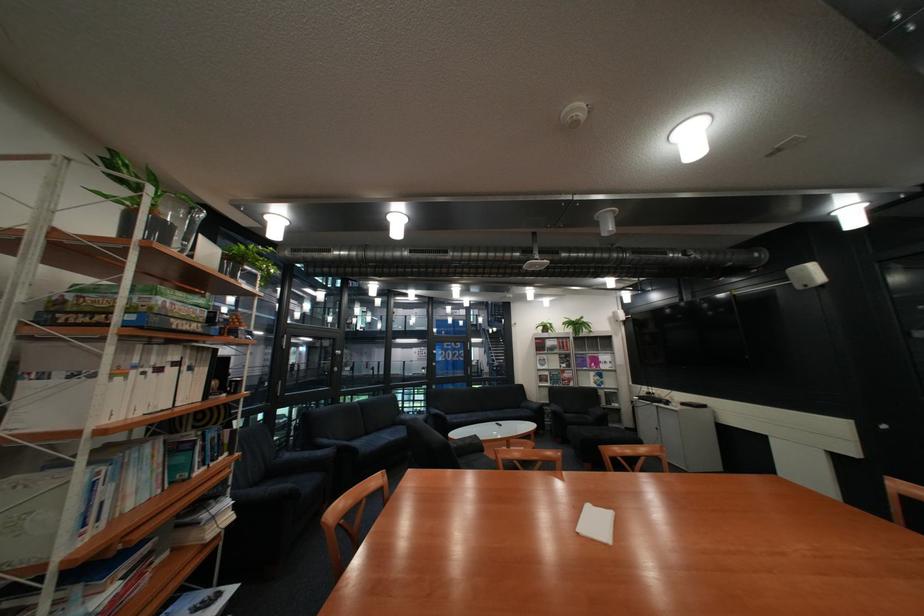
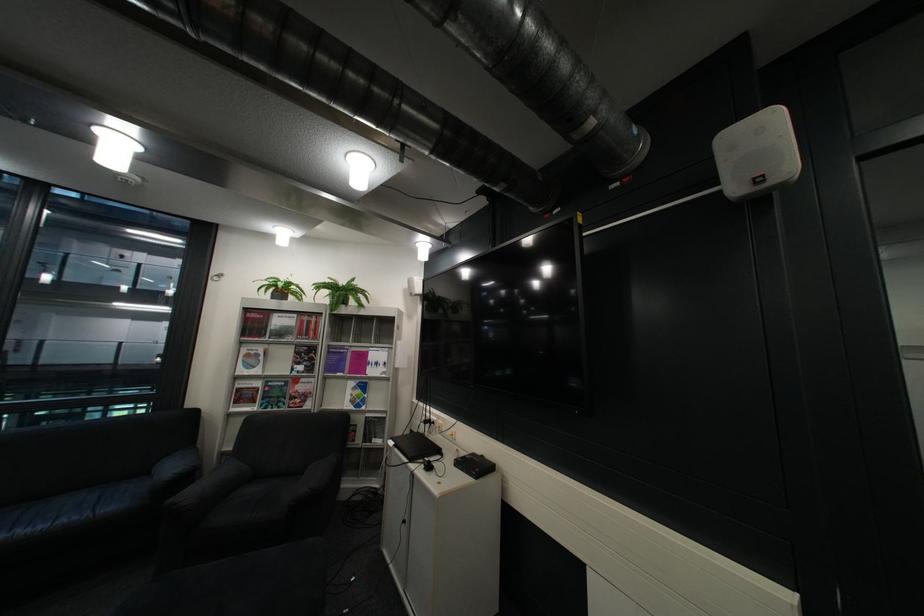
Find the pixel in the second image that matches the point at 576,358 in the first image.

(311, 353)